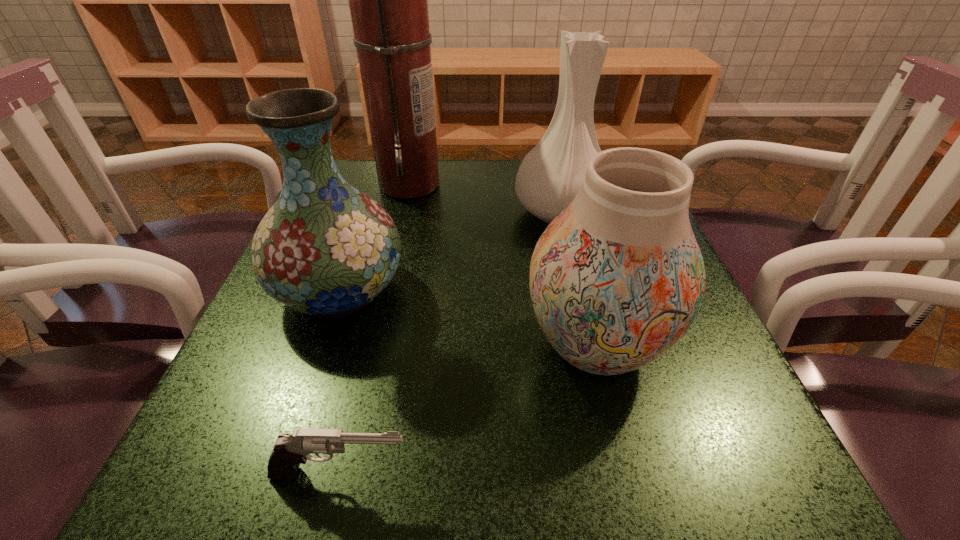
Where is `vase situated at the far edge`? The width and height of the screenshot is (960, 540). vase situated at the far edge is located at coordinates (550, 176).

You are a GUI agent. You are given a task and a screenshot of the screen. Output one action in this format:
    pyautogui.click(x=<x>, y=<y>)
    Task: Click on the object located in the near edge section of the desktop
    Image resolution: width=960 pixels, height=540 pixels.
    Given the screenshot: What is the action you would take?
    pyautogui.click(x=289, y=451)

Identify the location of fire extinguisher located at the left edge. (388, 2).

You are a GUI agent. You are given a task and a screenshot of the screen. Output one action in this format:
    pyautogui.click(x=<x>, y=<y>)
    Task: Click on the vase that is positioned at the left edge
    The width and height of the screenshot is (960, 540).
    Given the screenshot: What is the action you would take?
    pyautogui.click(x=326, y=249)

Find the location of `gun that is at the left edge`. gun that is at the left edge is located at coordinates (289, 451).

Identify the location of object present at the far left corner. This screenshot has height=540, width=960. (388, 2).

Locate an element on the screen. The image size is (960, 540). object at the near left corner is located at coordinates tap(289, 451).

Locate an element on the screen. The width and height of the screenshot is (960, 540). object at the far right corner is located at coordinates (550, 176).

Locate an element on the screen. This screenshot has height=540, width=960. free spot at the far edge of the desktop is located at coordinates (498, 187).

In the image, there is a desktop. Where is `vacant space at the left edge`? The image size is (960, 540). vacant space at the left edge is located at coordinates (336, 376).